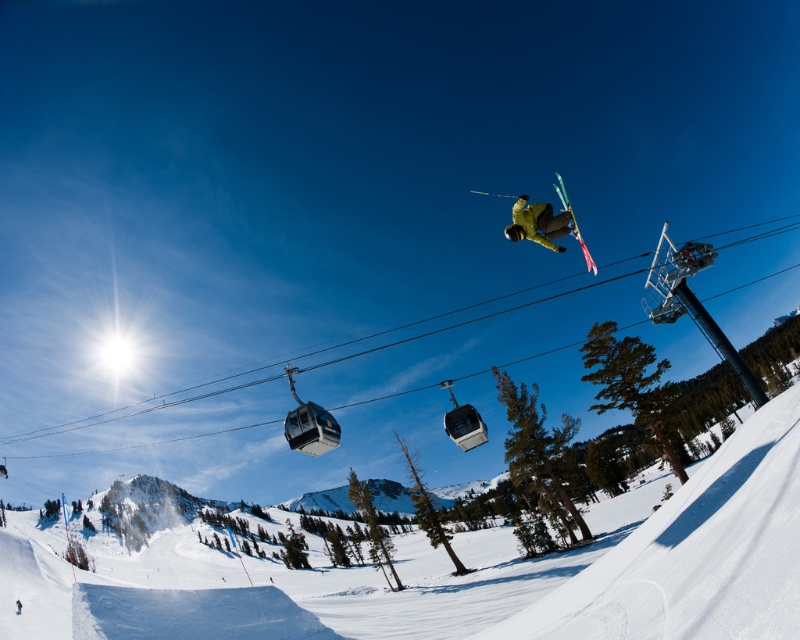
Which is above, metallic cable car at center or yellow matte snowboarder at center?

yellow matte snowboarder at center is higher up.

Is metallic cable car at center positioned at the back of yellow matte snowboarder at center?

That is True.

Describe the element at coordinates (310, 424) in the screenshot. This screenshot has height=640, width=800. I see `metallic cable car at center` at that location.

This screenshot has width=800, height=640. I want to click on metallic cable car at center, so click(310, 424).